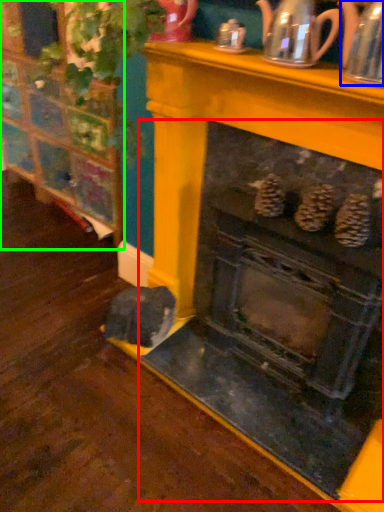
Question: Which object is the closest to the fireplace (highlighted by a red box)? Choose among these: tea pot (highlighted by a blue box) or furniture (highlighted by a green box).

Choices:
 (A) tea pot
 (B) furniture

Answer: (A)